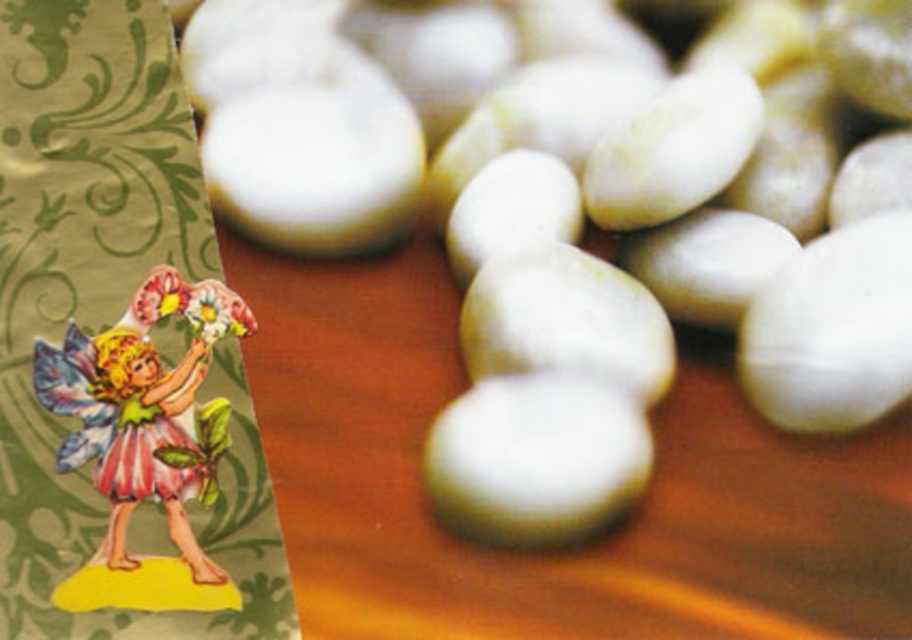
Question: Which object is closer to the camera taking this photo?

Choices:
 (A) white smooth stone at left
 (B) pastel paper fairy at left
 (C) paper fairy at left

Answer: (C)

Question: Is white smooth stone at left positioned in front of paper fairy at left?

Choices:
 (A) no
 (B) yes

Answer: (A)

Question: Is paper fairy at left smaller than pastel paper fairy at left?

Choices:
 (A) no
 (B) yes

Answer: (A)

Question: In this image, where is white smooth stone at left located relative to pastel paper fairy at left?

Choices:
 (A) below
 (B) above

Answer: (B)

Question: Which point is closer to the camera taking this photo?

Choices:
 (A) (193, 456)
 (B) (252, 314)
 (C) (809, 417)

Answer: (A)

Question: Estimate the real-world distances between objects in this image. Which object is farther from the white smooth stone at left?

Choices:
 (A) paper fairy at left
 (B) pastel paper fairy at left

Answer: (B)